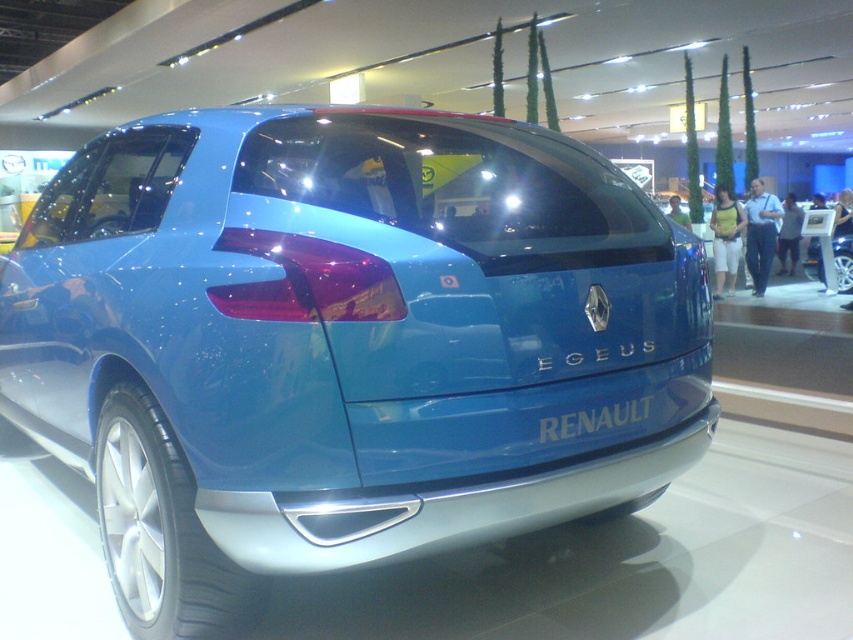
You are standing behind the Renault Egeus concept car at the auto show. You notice two points marked on its rear panel. The first point is at coordinate point (468, 392) and the second at point (817, 218). From your current position, which point is closer to you?

Point (468, 392) is in front of point (817, 218), so from your position behind the car, the point closer to you would be point (817, 218).

You are at an auto show and see two Renault Egeus concept cars displayed at the center of the image. The glossy blue car at center and the matte blue car at center. Which one is positioned lower?

The glossy blue car at center is positioned lower than the matte blue car at center according to the description.

In the scene shown: You are at an auto show and see two Renault Egeus concept cars displayed side by side. Both are painted in blue, but one has a glossy finish and the other a matte finish. You need to park a car that is 2 meters wide between them. Can you fit the car between the glossy blue car at center and the matte blue car at center based on their widths?

The glossy blue car at center is wider than the matte blue car at center. Since the glossy blue car at center is wider, the space between them may be sufficient to accommodate a 2 meter wide car, but the exact width difference isn